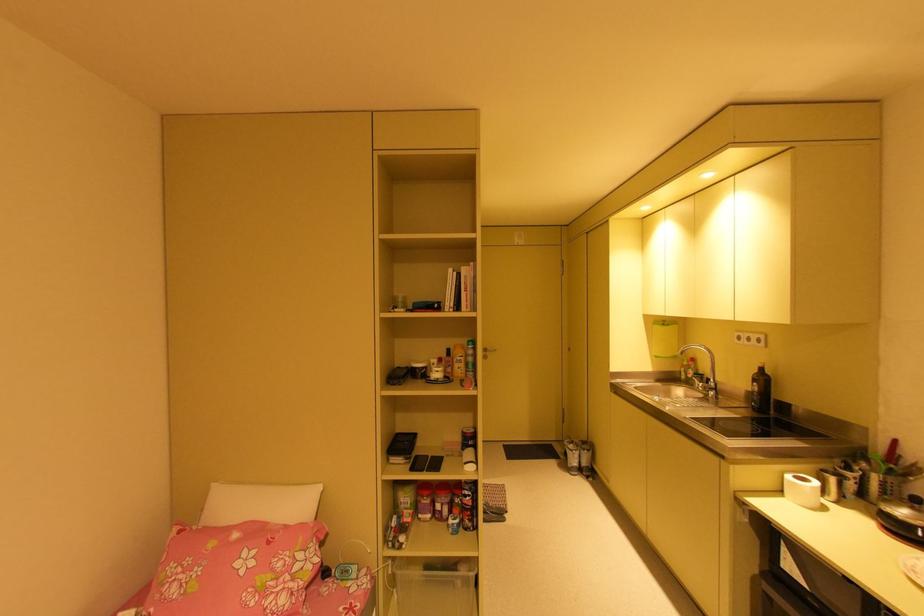
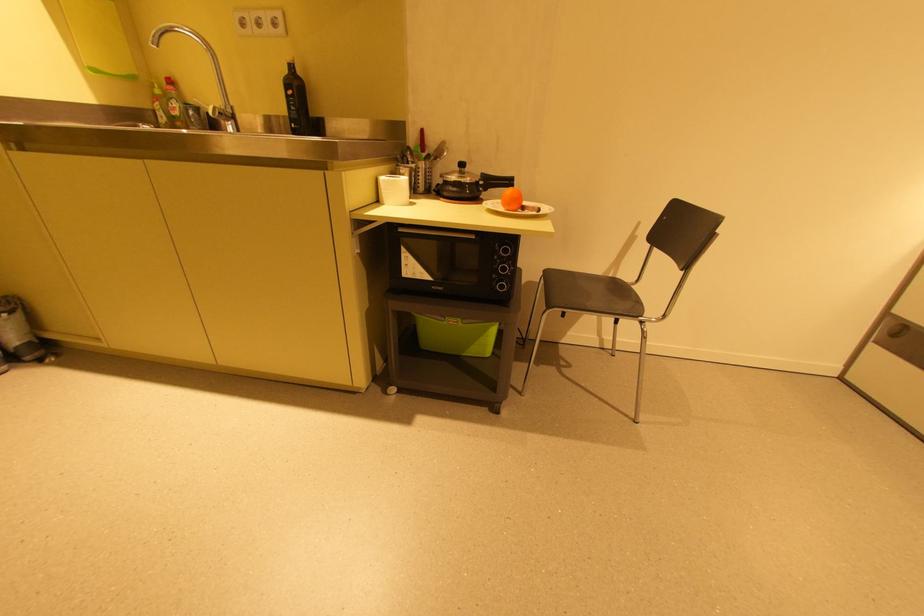
Where in the second image is the point corresponding to the point at 742,334 from the first image?

(242, 17)